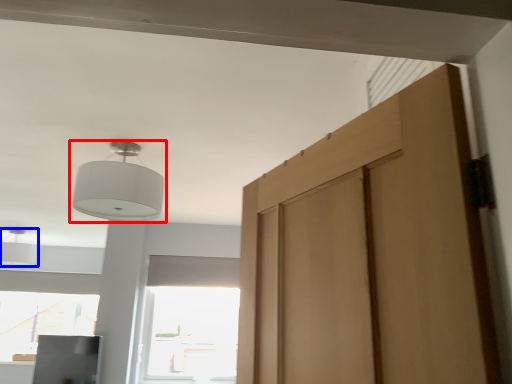
Question: Which object appears farthest to the camera in this image, lamp (highlighted by a red box) or light (highlighted by a blue box)?

Choices:
 (A) lamp
 (B) light

Answer: (B)